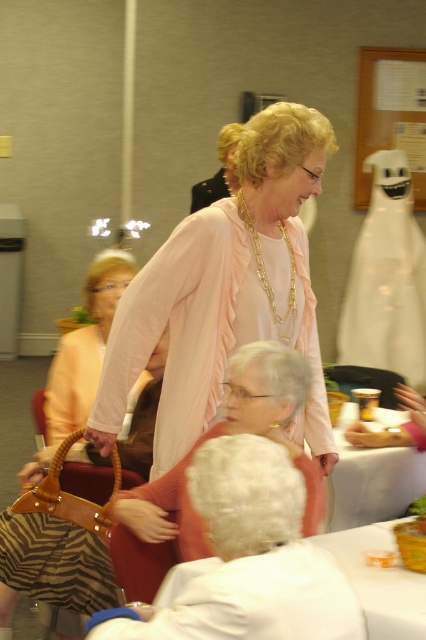
Question: Is matte pink cardigan at center positioned at the back of gold chain necklace at center?

Choices:
 (A) no
 (B) yes

Answer: (A)

Question: Based on their relative distances, which object is nearer to the white cloth at center?

Choices:
 (A) gold chain necklace at center
 (B) smooth orange bowl at lower right

Answer: (B)

Question: Among these points, which one is nearest to the camera?

Choices:
 (A) (296, 308)
 (B) (379, 522)
 (C) (222, 161)
 (D) (345, 512)

Answer: (B)

Question: Is matte pink sweater at center further to the viewer compared to white fabric table at lower center?

Choices:
 (A) yes
 (B) no

Answer: (A)

Question: Which of the following is the closest to the observer?

Choices:
 (A) (259, 627)
 (B) (385, 624)
 (C) (373, 349)

Answer: (A)

Question: Is white fabric table at lower center in front of smooth orange bowl at lower right?

Choices:
 (A) yes
 (B) no

Answer: (A)